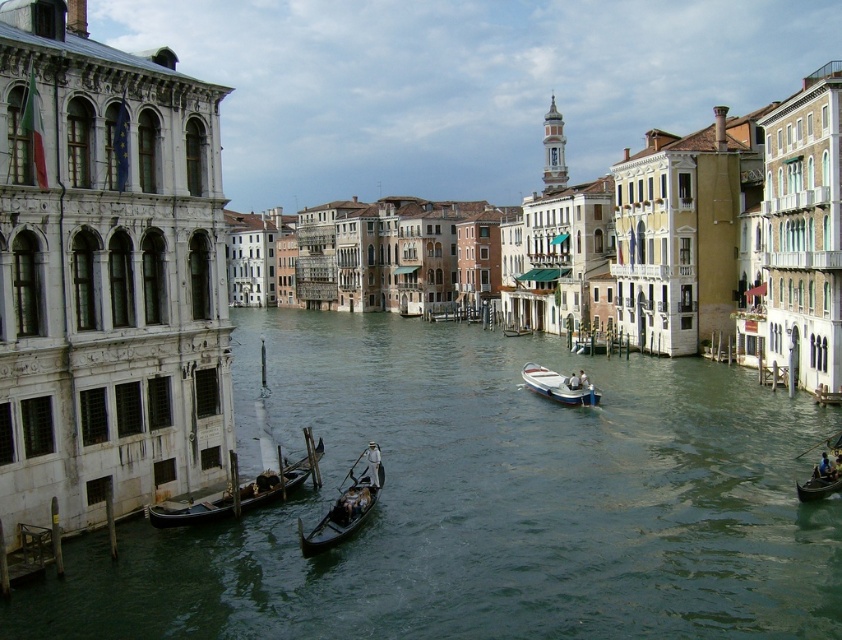
Question: Which of the following is the farthest from the observer?

Choices:
 (A) greenish water at center
 (B) white plastic boat at center
 (C) black polished wood gondola at center
 (D) black polished gondola at lower left

Answer: (B)

Question: Which of the following is the closest to the observer?

Choices:
 (A) (574, 387)
 (B) (253, 506)

Answer: (B)

Question: Based on their relative distances, which object is farther from the white plastic boat at center?

Choices:
 (A) black polished wood gondola at center
 (B) black polished gondola at lower left
 (C) greenish water at center
 (D) wooden dark brown boat at lower right

Answer: (B)

Question: Is black polished gondola at lower left bigger than wooden dark brown boat at lower right?

Choices:
 (A) yes
 (B) no

Answer: (A)

Question: Does black polished gondola at lower left come in front of wooden dark brown boat at lower right?

Choices:
 (A) no
 (B) yes

Answer: (B)

Question: Can you confirm if greenish water at center is positioned to the right of wooden dark brown boat at lower right?

Choices:
 (A) no
 (B) yes

Answer: (A)